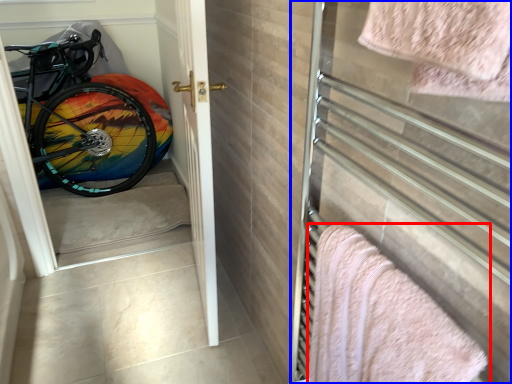
Question: Which object is further to the camera taking this photo, towel (highlighted by a red box) or screen door (highlighted by a blue box)?

Choices:
 (A) towel
 (B) screen door

Answer: (A)